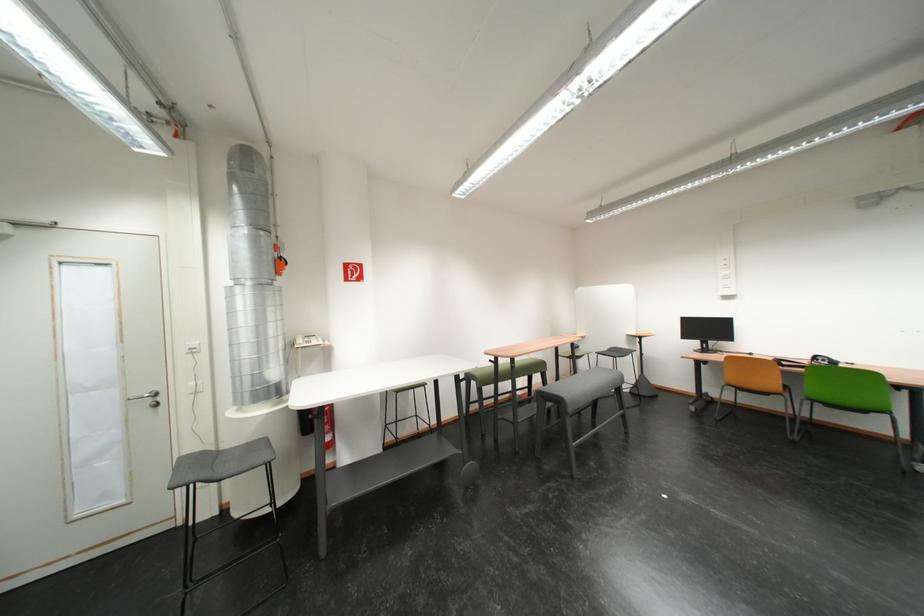
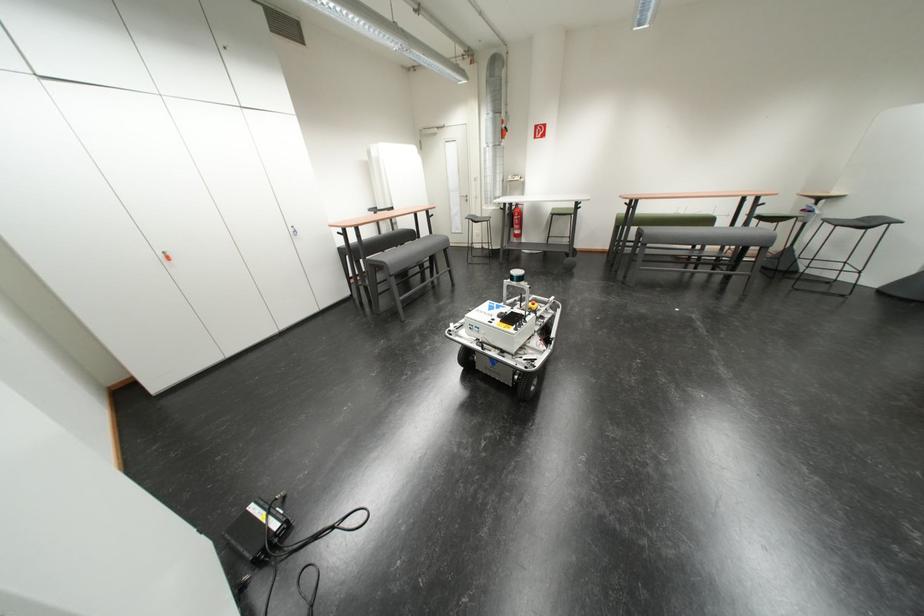
Find the pixel in the second image that matches [610,355] in the first image.

(837, 223)